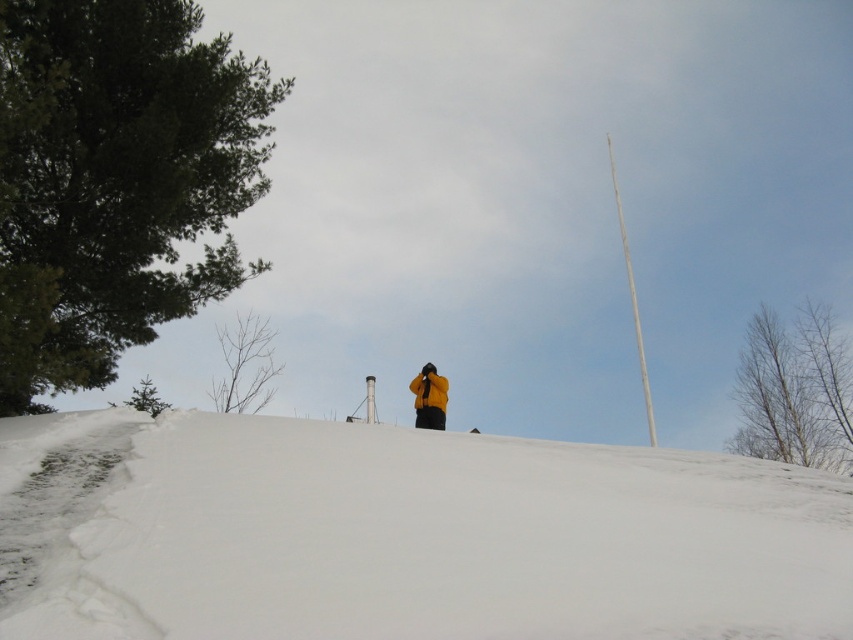
You are standing at the point marked by coordinates point (x=244, y=365) in the snowy landscape. Looking around, you see a large evergreen tree with dense foliage on the left and a tall slender pole on the right. Which direction should you face to see the bare branches at left?

The point (x=244, y=365) corresponds to the bare branches at left, so facing towards the large evergreen tree with dense foliage on the left would allow you to see the bare branches at left.

You are a hiker trying to navigate through the snowy area. You see the green leafy tree at upper left and the bare branches at left. Which one is taller?

The green leafy tree at upper left is taller than the bare branches at left.